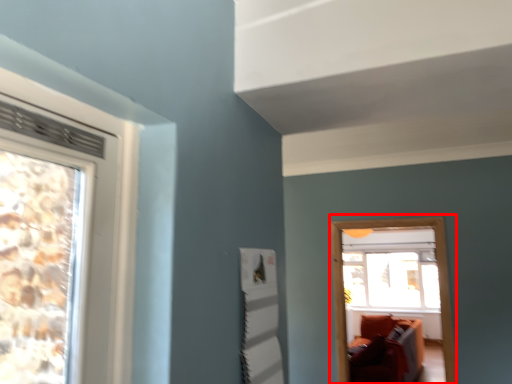
Question: Considering the relative positions of window frame (annotated by the red box) and window in the image provided, where is window frame (annotated by the red box) located with respect to the staircase?

Choices:
 (A) left
 (B) right

Answer: (A)